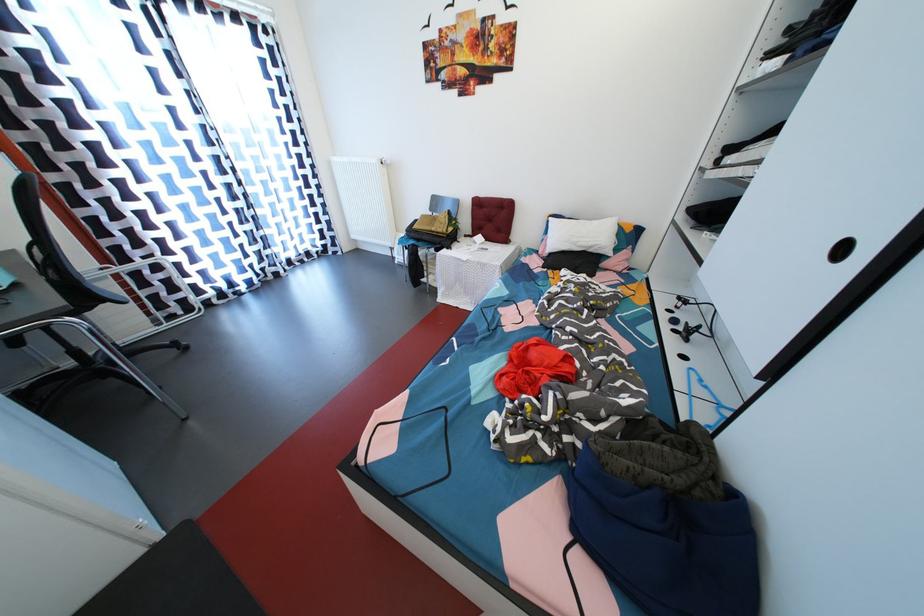
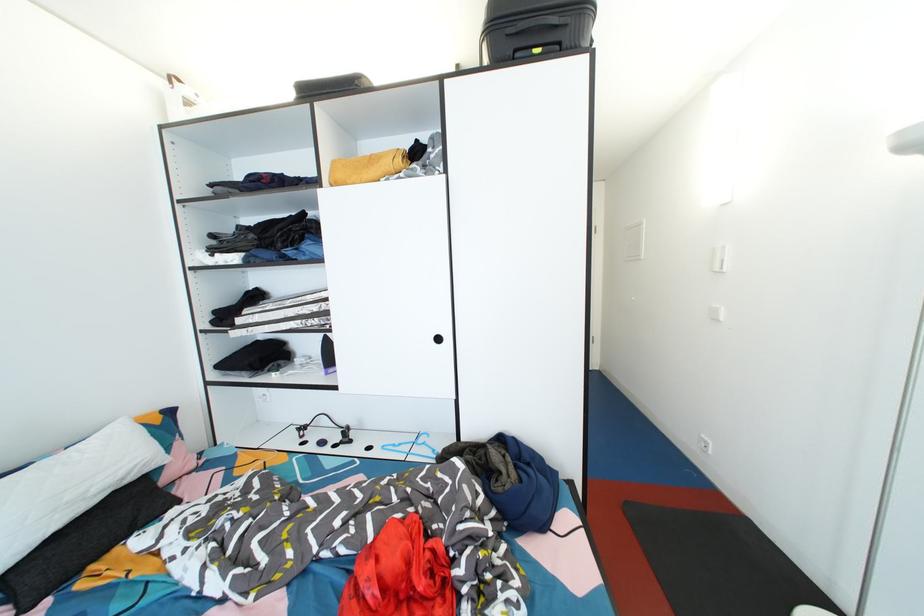
First-person continuous shooting, in which direction is the camera rotating?

The camera's rotation is toward right-down.